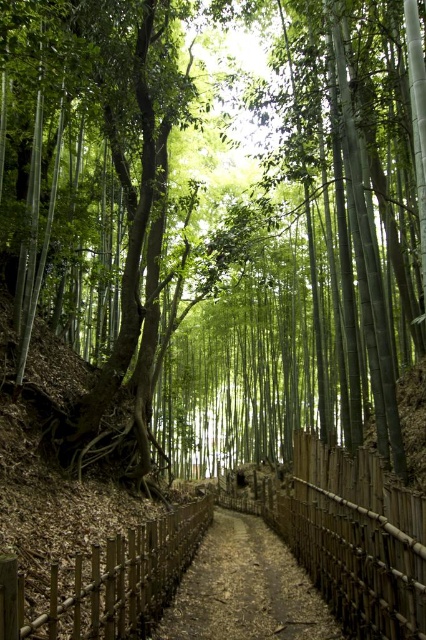
You are a hiker who wants to cross the path in the bamboo grove. You see the wooden fence at center and the brown wooden trail at center. Which one is taller?

The wooden fence at center is much taller than the brown wooden trail at center.

You are a hiker walking along the wooden fence at center and the brown wooden trail at center. Which object is located to the left side from your perspective?

The wooden fence at center is to the left of the brown wooden trail at center, so the wooden fence at center is on the left side.

Consider the image. You are a hiker walking along the bamboo grove pathway. You notice two fences at the center of the path. Which one is thinner between the bamboo fence at center and the wooden fence at center?

The bamboo fence at center is thinner than the wooden fence at center according to the description.